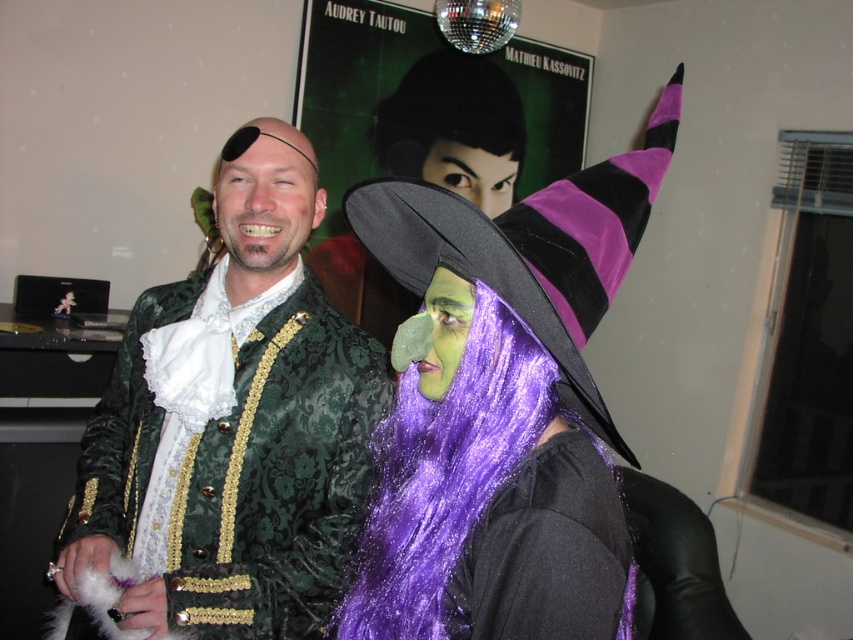
Question: Which point is closer to the camera?

Choices:
 (A) green velvet jacket at center
 (B) shiny green velvet jacket at left

Answer: (B)

Question: Which point is farther to the camera?

Choices:
 (A) purple glittery wig at center
 (B) shiny green velvet jacket at left
 (C) black shiny hair at upper center

Answer: (C)

Question: Can you confirm if purple satin witch hat at upper right is thinner than purple glittery wig at center?

Choices:
 (A) yes
 (B) no

Answer: (B)

Question: Can you confirm if shiny green velvet jacket at left is positioned above purple satin witch hat at upper right?

Choices:
 (A) no
 (B) yes

Answer: (A)

Question: Based on their relative distances, which object is nearer to the green velvet jacket at center?

Choices:
 (A) purple satin witch hat at upper right
 (B) purple glittery wig at center

Answer: (B)

Question: Is shiny green velvet jacket at left below purple glittery wig at center?

Choices:
 (A) yes
 (B) no

Answer: (B)